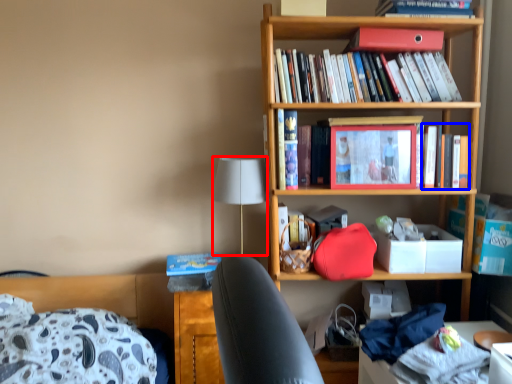
Question: Which of the following is the closest to the observer, lamp (highlighted by a red box) or book (highlighted by a blue box)?

Choices:
 (A) lamp
 (B) book

Answer: (A)